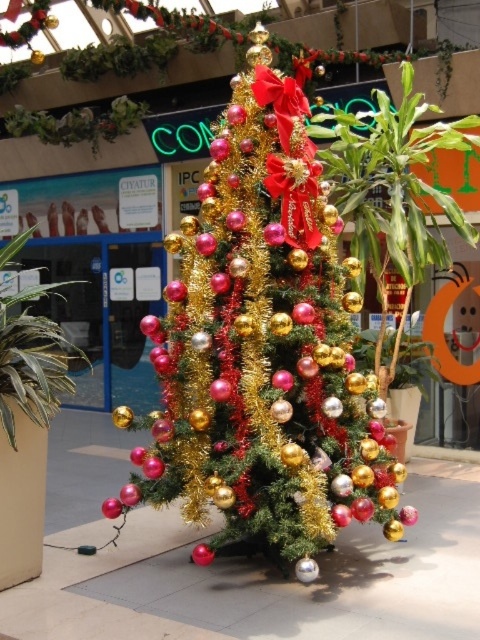
Consider the image. You are a customer in the mall and want to take a photo of the shiny metallic christmas tree at center and the green leafy plant at left. Which object should you focus on first if you want to capture both in one frame without moving the camera?

You should focus on the shiny metallic christmas tree at center first because it is larger than the green leafy plant at left, so it will be more prominent in the frame.

You are a visitor at the mall and want to take a photo of the shiny metallic christmas tree at center and the green leafy plant at left. Which object should you focus on first to ensure both are in frame?

You should focus on the shiny metallic christmas tree at center first because it is closer to you than the green leafy plant at left, so adjusting the camera to include both would require framing starting from the closer object.

You are a photographer standing in the mall and want to take a photo of the shiny metallic christmas tree at center. If your camera has a minimum focusing distance of 2 meters, will you be able to take a clear photo without moving closer?

The distance between you and the shiny metallic christmas tree at center is 3.31 meters, which is greater than the camera minimum focusing distance of 2 meters. Therefore, you can take a clear photo without moving closer.